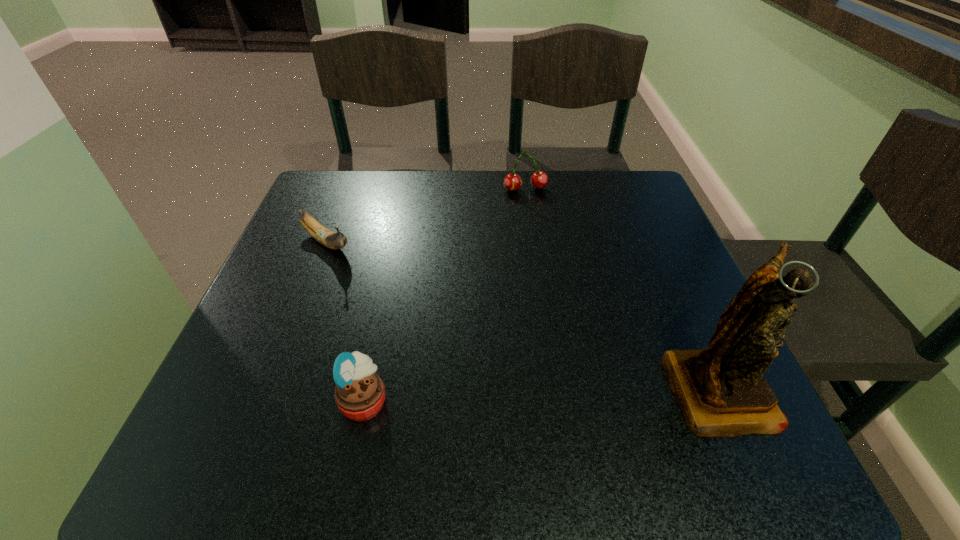
What are the coordinates of `vacant space on the desktop that is between the muffin and the figurine and is positioned on the peel of the second farthest object` in the screenshot? It's located at 528,394.

At what (x,y) coordinates should I click in order to perform the action: click on free spot on the desktop that is between the muffin and the tallest object and is positioned with stems pointing upwards on the farthest object. Please return your answer as a coordinate pair (x, y). The image size is (960, 540). Looking at the image, I should click on (590, 392).